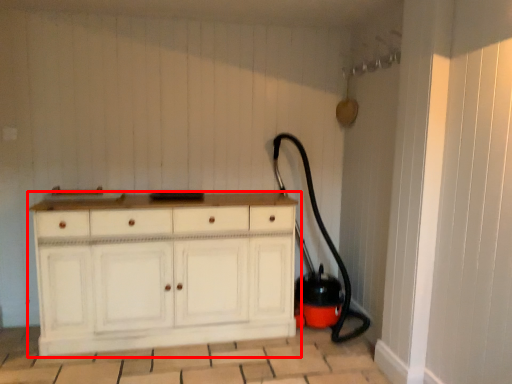
Question: From the image's perspective, what is the correct spatial relationship of chest of drawers (annotated by the red box) in relation to garden hose?

Choices:
 (A) above
 (B) below

Answer: (B)